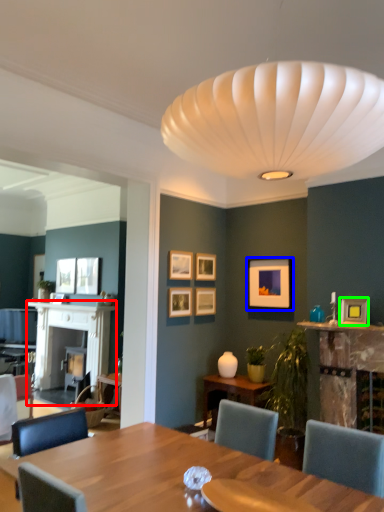
Question: Which is farther away from fireplace (highlighted by a red box)? picture frame (highlighted by a blue box) or picture frame (highlighted by a green box)?

Choices:
 (A) picture frame
 (B) picture frame

Answer: (B)